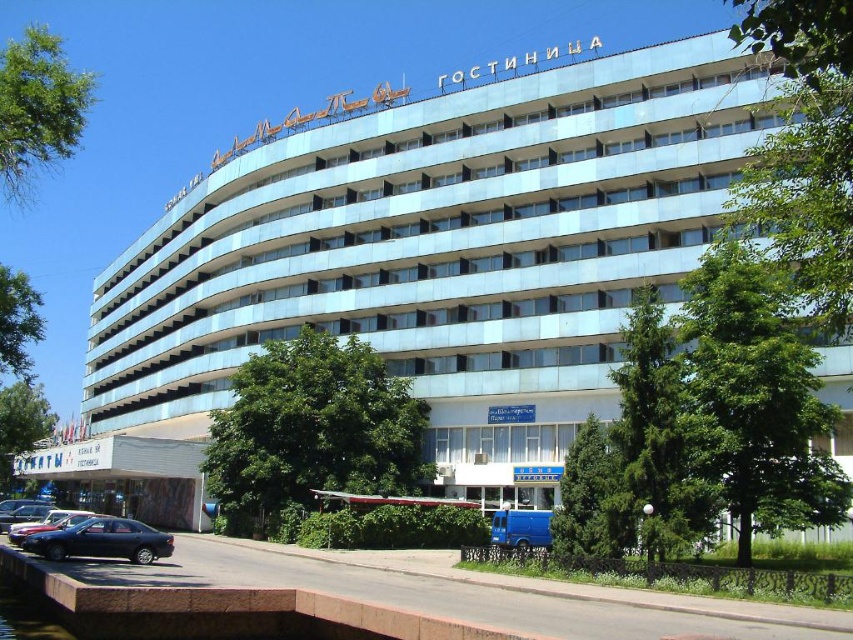
Which is more to the left, matte black sedan at lower left or metallic blue sedan at lower left?

From the viewer's perspective, metallic blue sedan at lower left appears more on the left side.

Can you confirm if matte black sedan at lower left is shorter than metallic blue sedan at lower left?

Incorrect, matte black sedan at lower left's height does not fall short of metallic blue sedan at lower left's.

Where is `matte black sedan at lower left`? The width and height of the screenshot is (853, 640). matte black sedan at lower left is located at coordinates (102, 540).